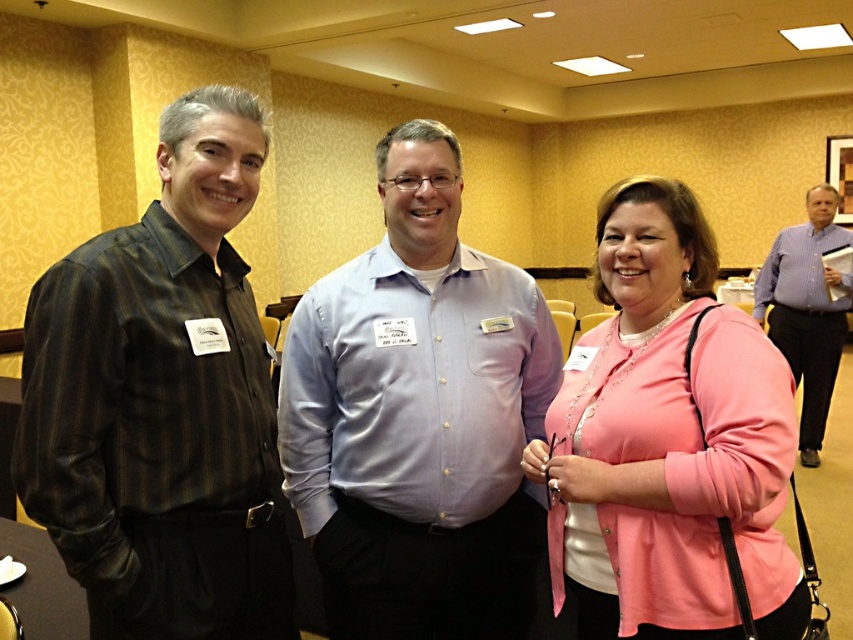
Is matte black shirt at left further to camera compared to light blue button-down shirt at center?

No, it is not.

Is matte black shirt at left smaller than light blue button-down shirt at center?

Yes.

You are a GUI agent. You are given a task and a screenshot of the screen. Output one action in this format:
    pyautogui.click(x=<x>, y=<y>)
    Task: Click on the matte black shirt at left
    This screenshot has width=853, height=640.
    Given the screenshot: What is the action you would take?
    pyautogui.click(x=161, y=401)

Can you confirm if light blue button-down shirt at center is shorter than pink satin blouse at center?

No, light blue button-down shirt at center is not shorter than pink satin blouse at center.

Does point (285, 346) come in front of point (654, 212)?

That is False.

Does point (520, 273) come closer to viewer compared to point (627, 420)?

No, it is behind (627, 420).

This screenshot has width=853, height=640. I want to click on light blue button-down shirt at center, so click(419, 417).

Which of these two, light blue button-down shirt at center or blue button-down shirt at right, stands shorter?

With less height is light blue button-down shirt at center.

Does light blue button-down shirt at center have a larger size compared to blue button-down shirt at right?

Incorrect, light blue button-down shirt at center is not larger than blue button-down shirt at right.

Who is more distant from viewer, (x=320, y=442) or (x=753, y=300)?

The point (x=753, y=300) is behind.

Locate an element on the screen. The width and height of the screenshot is (853, 640). light blue button-down shirt at center is located at coordinates (419, 417).